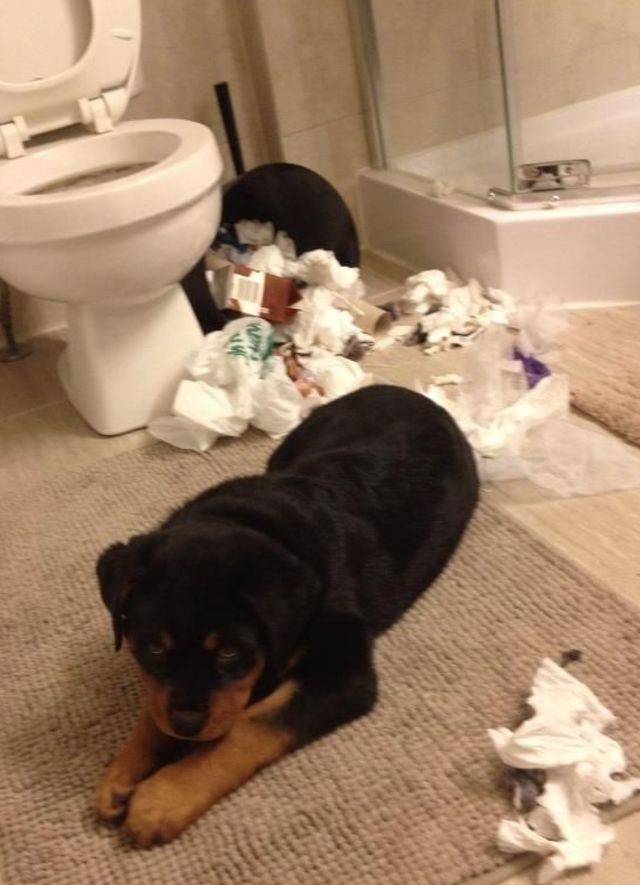
I want to click on trash can, so click(303, 197).